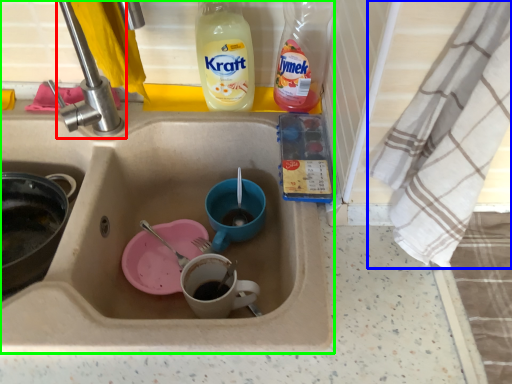
Question: Based on their relative distances, which object is farther from tap (highlighted by a red box)? Choose from cloth (highlighted by a blue box) and sink (highlighted by a green box).

Choices:
 (A) cloth
 (B) sink

Answer: (A)